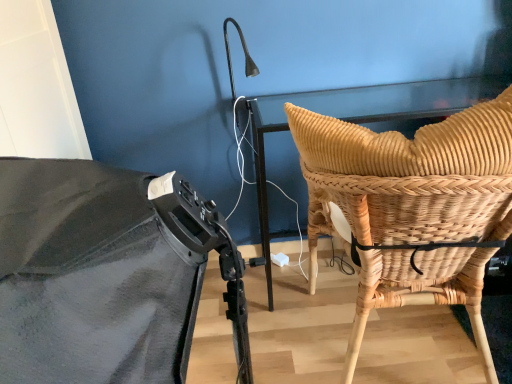
Identify the location of free space underneath woven wood chair at right (from a real-world perspective). Image resolution: width=512 pixels, height=384 pixels. (389, 340).